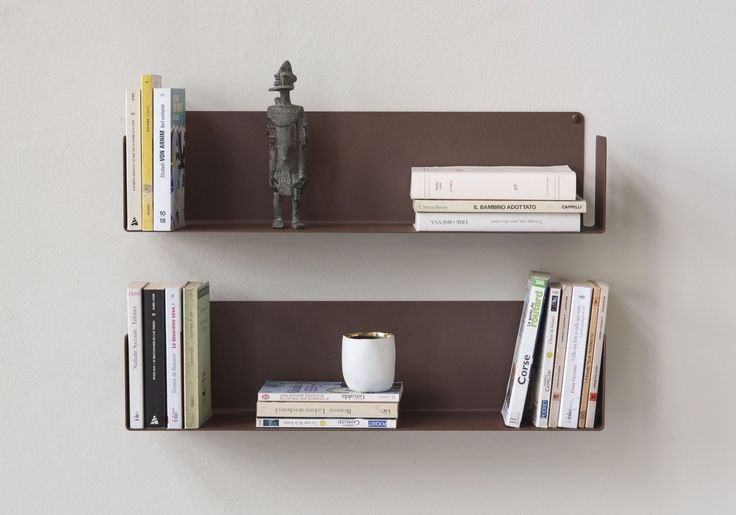
The width and height of the screenshot is (736, 515). Find the location of `book that is laid horizontally`. book that is laid horizontally is located at coordinates (277, 394), (283, 409), (297, 423), (439, 222), (450, 205), (452, 188).